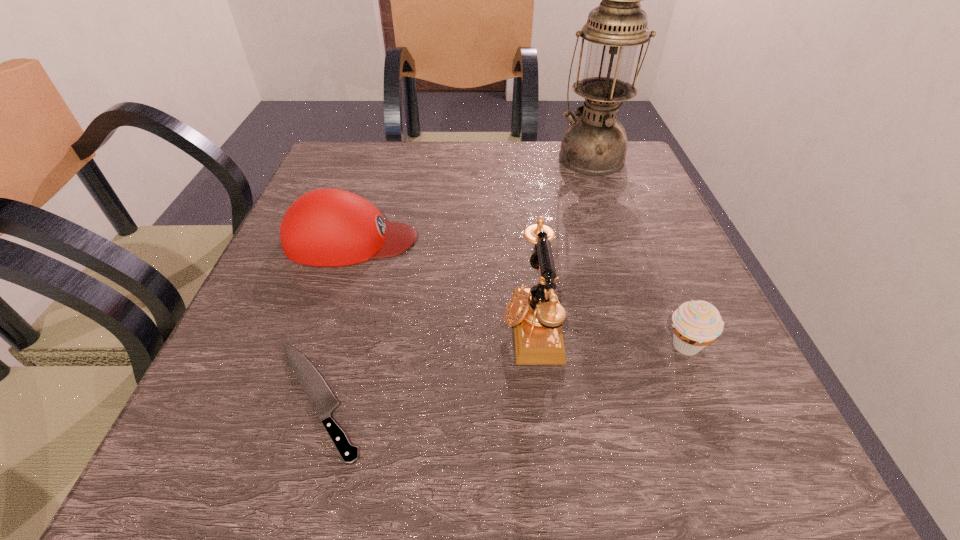
The width and height of the screenshot is (960, 540). Identify the location of the farthest object. (595, 143).

Find the location of a particular element. This screenshot has height=540, width=960. oil lamp is located at coordinates (595, 143).

Image resolution: width=960 pixels, height=540 pixels. In order to click on the third object from left to right in this screenshot , I will do `click(536, 314)`.

I want to click on the fourth shortest object, so click(536, 314).

Where is `baseball cap`? This screenshot has width=960, height=540. baseball cap is located at coordinates (327, 227).

At what (x,y) coordinates should I click in order to perform the action: click on muffin. Please return your answer as a coordinate pair (x, y). Looking at the image, I should click on (696, 324).

This screenshot has width=960, height=540. Find the location of `steak knife`. steak knife is located at coordinates (323, 401).

Identify the location of vacant area located 0.350m on the front of the tallest object. (636, 284).

Locate an element on the screen. free region located 0.300m on the dial of the telephone is located at coordinates (313, 326).

Locate an element on the screen. The height and width of the screenshot is (540, 960). free spot located 0.180m on the dial of the telephone is located at coordinates (390, 326).